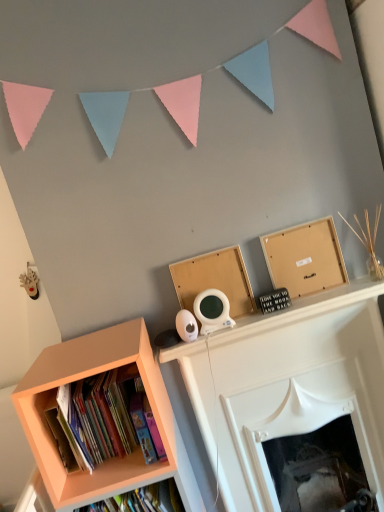
Question: From their relative heights in the image, would you say bare wood board at upper center is taller or shorter than white glossy fireplace at upper center?

Choices:
 (A) short
 (B) tall

Answer: (A)

Question: Visually, is bare wood board at upper center positioned to the left or to the right of white glossy fireplace at upper center?

Choices:
 (A) right
 (B) left

Answer: (B)

Question: Based on their relative distances, which object is farther from the matte orange bookcase at lower left?

Choices:
 (A) matte orange bookshelf at lower left
 (B) white glossy fireplace at upper center
 (C) bare wood board at upper center
 (D) pastel paper flags at upper center
 (E) wooden frame at upper right

Answer: (E)

Question: Estimate the real-world distances between objects in this image. Which object is farther from the matte orange bookcase at lower left?

Choices:
 (A) bare wood board at upper center
 (B) matte orange bookshelf at lower left
 (C) wooden frame at upper right
 (D) white glossy fireplace at upper center
 (E) pastel paper flags at upper center

Answer: (C)